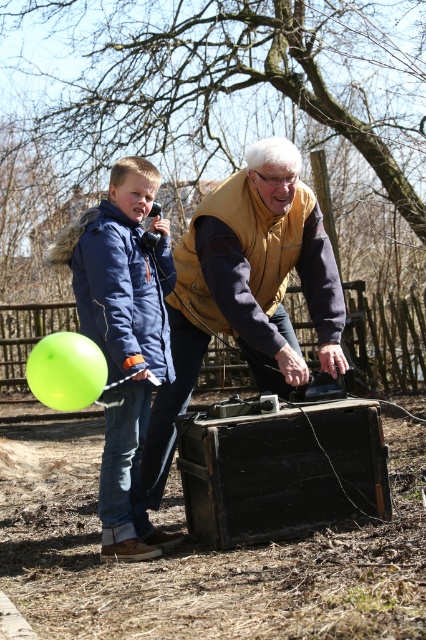
Question: Which object appears farthest from the camera in this image?

Choices:
 (A) matte yellow vest at center
 (B) green rubber balloon at lower left
 (C) matte blue jacket at left

Answer: (A)

Question: Among these objects, which one is farthest from the camera?

Choices:
 (A) matte yellow vest at center
 (B) matte blue jacket at left
 (C) green rubber balloon at lower left

Answer: (A)

Question: Considering the relative positions of matte yellow vest at center and matte blue jacket at left in the image provided, where is matte yellow vest at center located with respect to matte blue jacket at left?

Choices:
 (A) above
 (B) below

Answer: (A)

Question: Which point appears closest to the camera in this image?

Choices:
 (A) (60, 349)
 (B) (106, 269)

Answer: (A)

Question: Does matte blue jacket at left have a smaller size compared to green rubber balloon at lower left?

Choices:
 (A) yes
 (B) no

Answer: (B)

Question: Can you confirm if matte blue jacket at left is positioned below green rubber balloon at lower left?

Choices:
 (A) no
 (B) yes

Answer: (A)